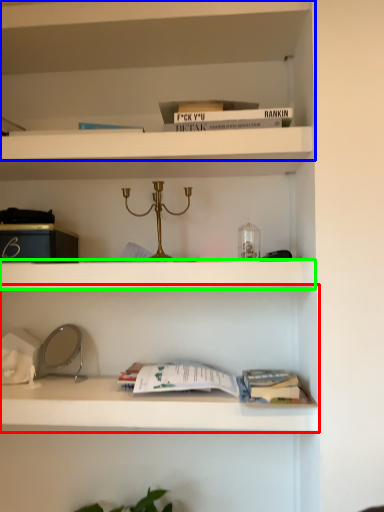
Question: Considering the real-world distances, which object is closest to shelf (highlighted by a red box)? shelf (highlighted by a blue box) or cabinet (highlighted by a green box).

Choices:
 (A) shelf
 (B) cabinet

Answer: (B)